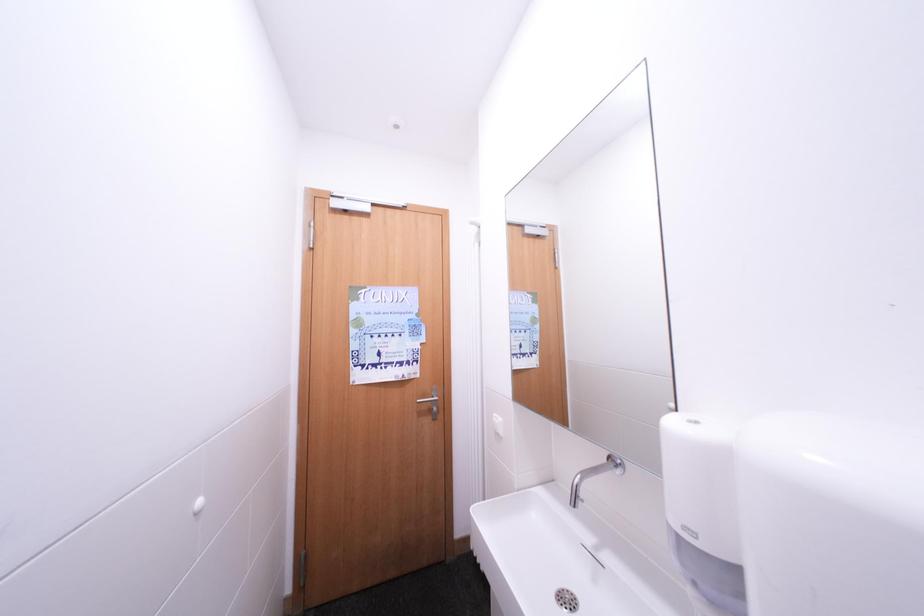
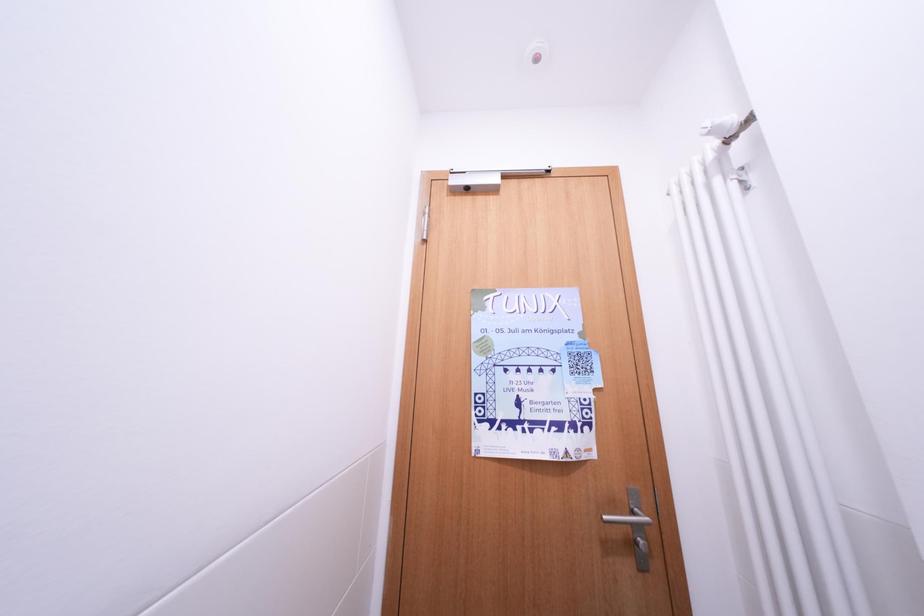
Question: The camera is either moving clockwise (left) or counter-clockwise (right) around the object. The first image is from the beginning of the video and the second image is from the end. Is the camera moving left or right when shooting the video?

Choices:
 (A) Left
 (B) Right

Answer: (B)